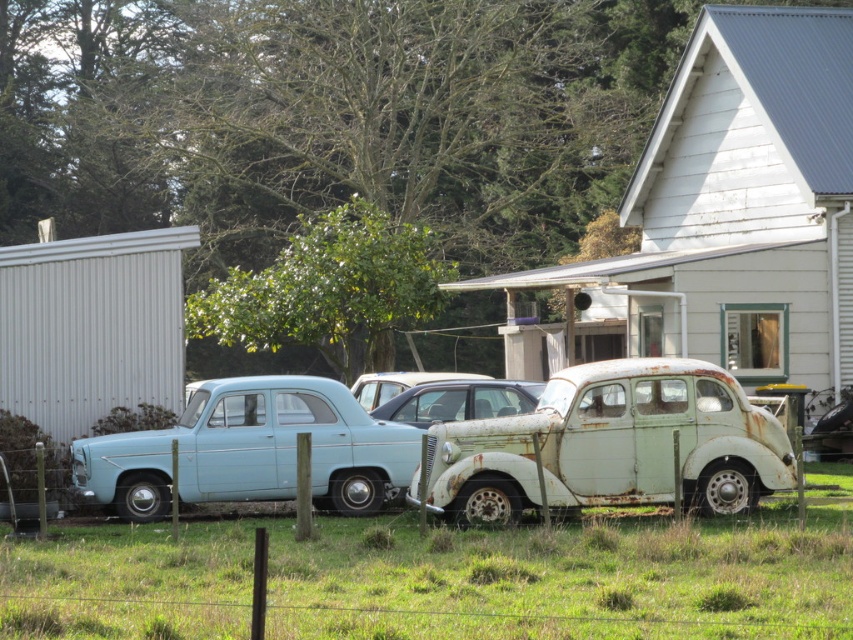
You are a gardener who wants to plant a new flower bed in the area between the green grass at lower center and the light blue matte sedan at center. Considering the height difference between these two objects, which one should you place the flowers closer to?

The green grass at lower center has a lesser height compared to the light blue matte sedan at center, so you should place the flowers closer to the green grass at lower center to ensure they are visible and not overshadowed by the taller sedan.

You are a delivery person trying to park your van, which is 2 meters wide, in the space between the light blue matte sedan at center and the rusty metal car at center. Can your van fit in that space?

The light blue matte sedan at center is wider than the rusty metal car at center. However, the exact width of the space between them isn not provided. Without knowing the distance between the two cars, it is impossible to determine if the van can fit.